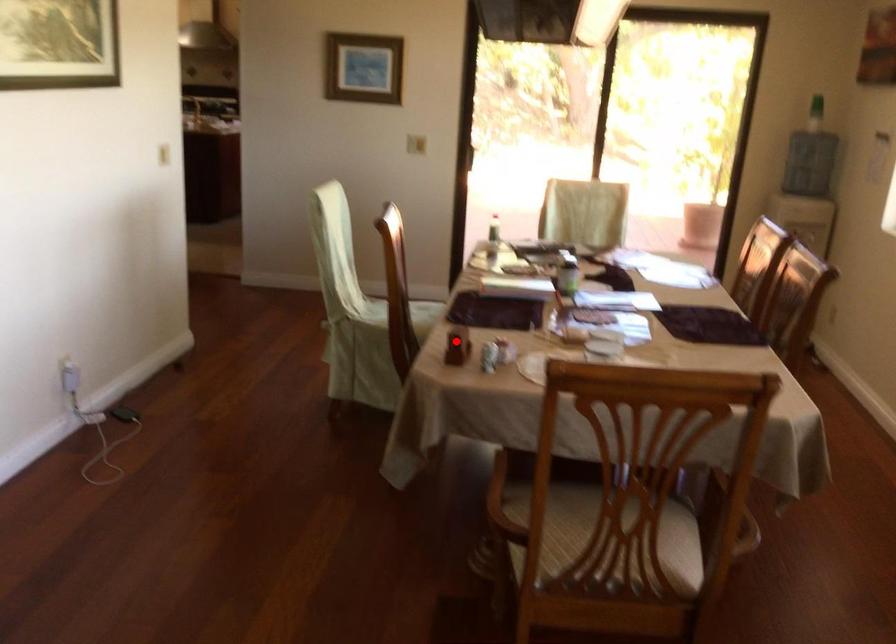
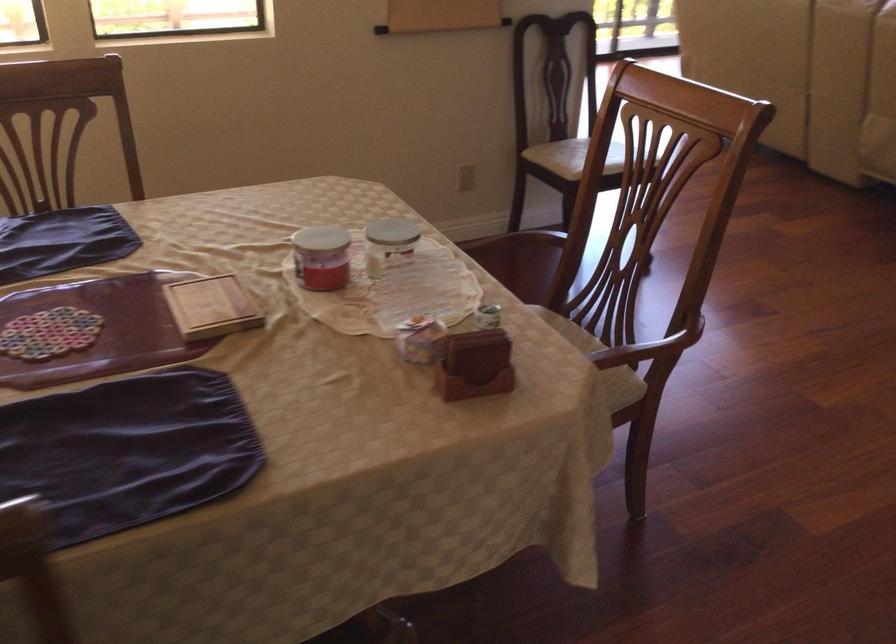
Question: I am providing you with two images of the same scene from different viewpoints. Given a red point in image1, look at the same physical point in image2. Is it:

Choices:
 (A) Closer to the viewpoint
 (B) Farther from the viewpoint

Answer: (A)